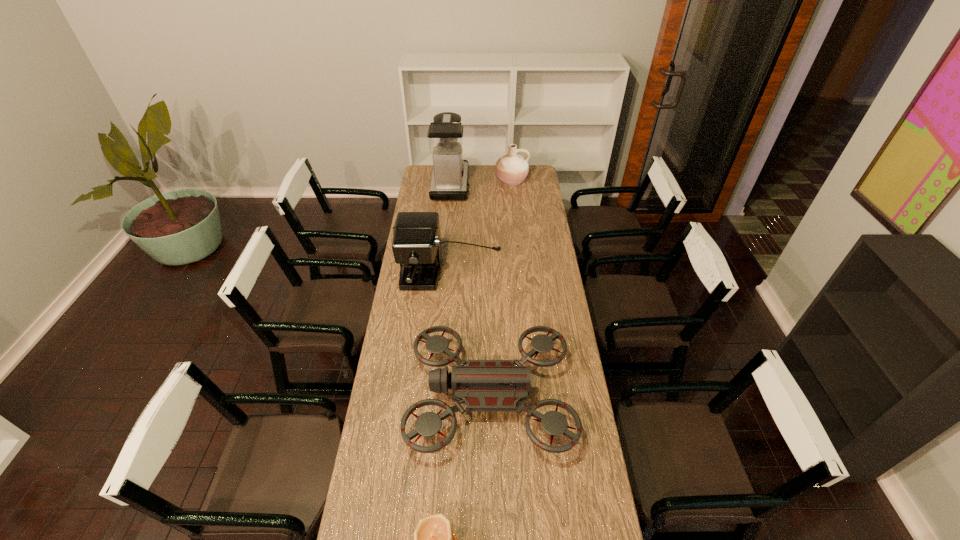
I want to click on the farther coffee maker, so click(449, 181).

Where is `the taller coffee maker`? This screenshot has height=540, width=960. the taller coffee maker is located at coordinates (449, 181).

The image size is (960, 540). Find the location of `the shorter coffee maker`. the shorter coffee maker is located at coordinates (416, 245).

In order to click on the second tallest object in this screenshot , I will do `click(416, 245)`.

Image resolution: width=960 pixels, height=540 pixels. What are the coordinates of `pottery` in the screenshot? It's located at (511, 169).

The width and height of the screenshot is (960, 540). In order to click on drone in this screenshot , I will do `click(482, 385)`.

Identify the location of vacant space located at the front of the tallest object where the controls are located. (527, 185).

Identify the location of blank space located 0.310m on the front-facing side of the fourth shortest object. Image resolution: width=960 pixels, height=540 pixels. (444, 359).

Locate an element on the screen. This screenshot has height=540, width=960. vacant area situated 0.100m to pour from the handle of the pottery is located at coordinates (513, 199).

Locate an element on the screen. This screenshot has width=960, height=540. free space located on the front-facing side of the fourth farthest object is located at coordinates (385, 397).